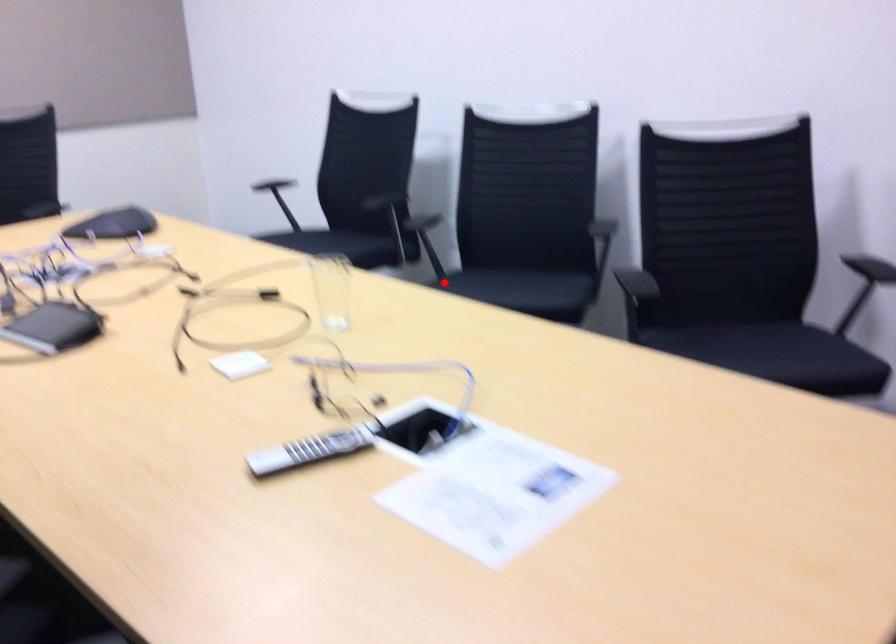
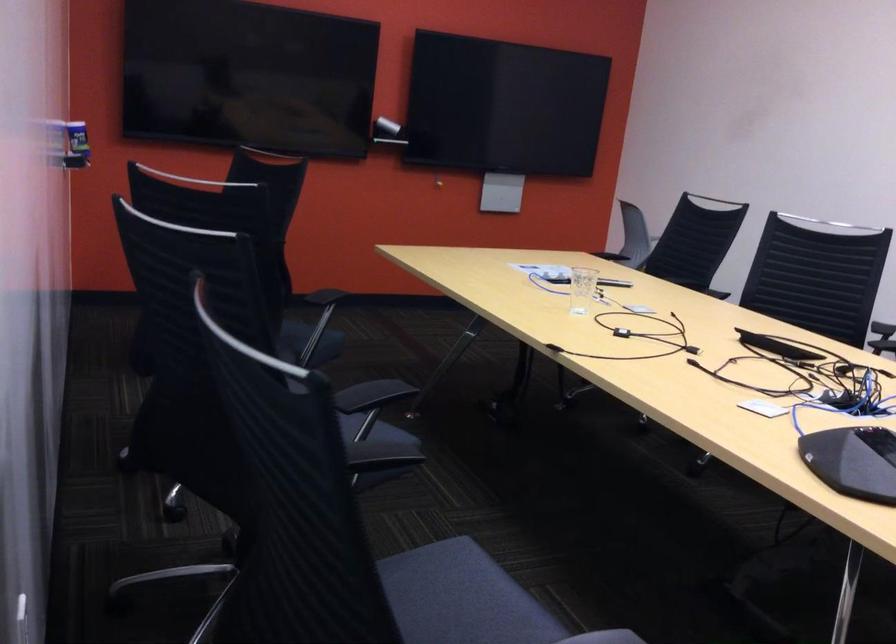
Question: I am providing you with two images of the same scene from different viewpoints. A red point is marked on the first image. Is the red point's position out of view in image 2?

Choices:
 (A) Yes
 (B) No

Answer: (B)